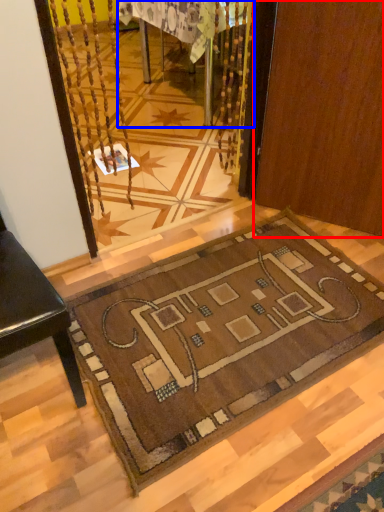
Question: Which point is closer to the camera, door (highlighted by a red box) or table (highlighted by a blue box)?

Choices:
 (A) door
 (B) table

Answer: (A)